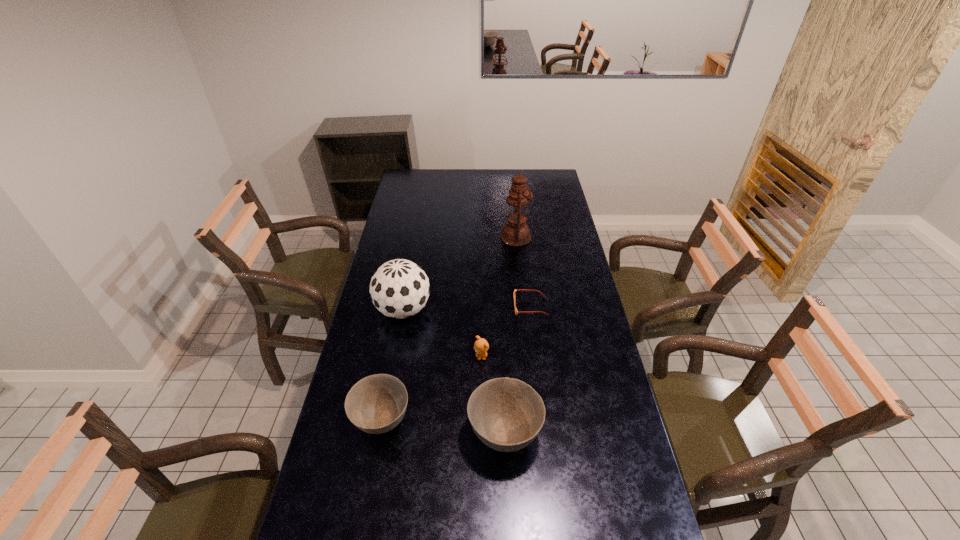
Identify the location of vacant region between the shorter bowl and the tallest object. This screenshot has width=960, height=540. (448, 329).

This screenshot has height=540, width=960. I want to click on vacant space that's between the tallest object and the fourth farthest object, so click(x=498, y=296).

You are a GUI agent. You are given a task and a screenshot of the screen. Output one action in this format:
    pyautogui.click(x=<x>, y=<y>)
    Task: Click on the free space between the third shortest object and the oil lamp
    The width and height of the screenshot is (960, 540).
    Given the screenshot: What is the action you would take?
    pyautogui.click(x=448, y=329)

The height and width of the screenshot is (540, 960). Identify the location of object identified as the fourth closest to the oil lamp. (506, 414).

Identify which object is located as the fifth nearest to the soccer ball. Please provide its 2D coordinates. Your answer should be formatted as a tuple, i.e. [(x, y)], where the tuple contains the x and y coordinates of a point satisfying the conditions above.

[(516, 233)]